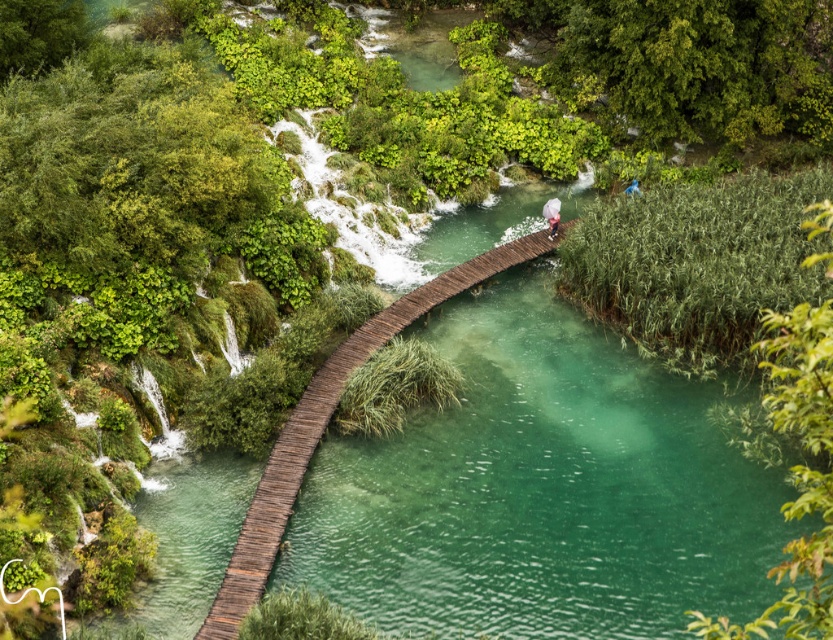
You are a photographer standing at the starting point of the boardwalk and want to capture both the light pink fabric umbrella at center and the blue fabric person at upper center in a single frame. Based on their sizes, which object should you focus on first to ensure both are in the shot?

The light pink fabric umbrella at center has a lesser width compared to the blue fabric person at upper center. To ensure both are in the shot, focus on the blue fabric person at upper center first since it is wider and requires more space in the frame.

You are standing at the starting point of the wooden bridge at center and want to reach the blue fabric person at upper center. Which direction should you walk to get closer to them?

You should walk to the right because the wooden bridge at center is to the left of the blue fabric person at upper center, so moving right along the bridge will bring you closer to them.

From the picture: You are standing on the wooden boardwalk and want to take a photo of both the light pink fabric umbrella at center and the blue fabric person at upper center. Which object should you focus on first to ensure both are in clear view?

You should focus on the light pink fabric umbrella at center first because it is closer to you than the blue fabric person at upper center, ensuring both are in clear view.